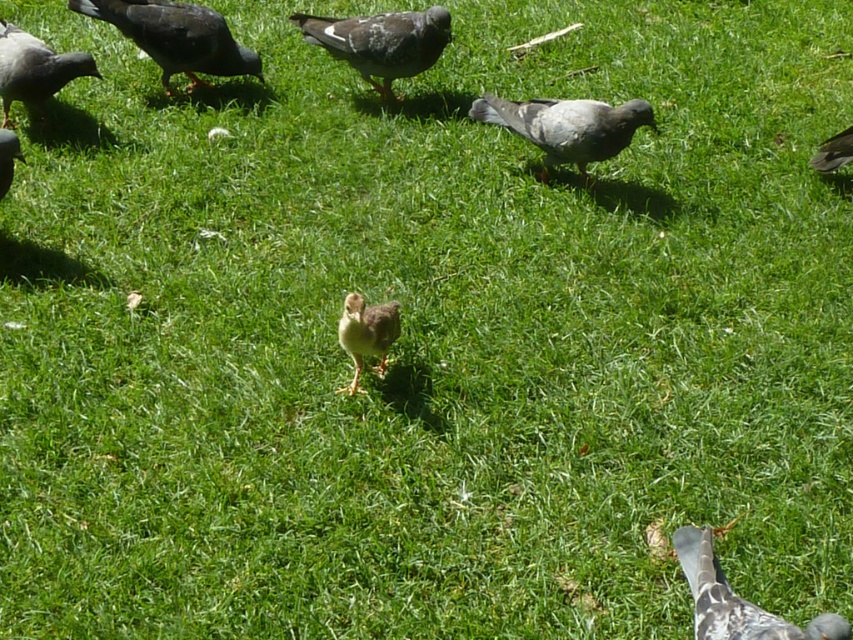
Can you confirm if gray matte pigeon at upper left is positioned below speckled feather pigeon at lower right?

Incorrect, gray matte pigeon at upper left is not positioned below speckled feather pigeon at lower right.

Does point (123, 22) come behind point (805, 637)?

Yes, it is.

Image resolution: width=853 pixels, height=640 pixels. I want to click on gray matte pigeon at upper left, so click(177, 36).

Which of these two, speckled feather pigeon at lower right or brown feathered pigeon at upper right, stands taller?

With more height is speckled feather pigeon at lower right.

Who is more forward, (712, 573) or (840, 132)?

Point (712, 573) is more forward.

You are a GUI agent. You are given a task and a screenshot of the screen. Output one action in this format:
    pyautogui.click(x=<x>, y=<y>)
    Task: Click on the speckled feather pigeon at lower right
    
    Given the screenshot: What is the action you would take?
    pyautogui.click(x=735, y=600)

Who is positioned more to the left, speckled feather pigeon at lower right or gray speckled pigeon at upper left?

gray speckled pigeon at upper left is more to the left.

Who is more forward, (x=726, y=624) or (x=35, y=88)?

Point (x=726, y=624)

What are the coordinates of `speckled feather pigeon at lower right` in the screenshot? It's located at (735, 600).

Where is `speckled feather pigeon at lower right`? speckled feather pigeon at lower right is located at coordinates (735, 600).